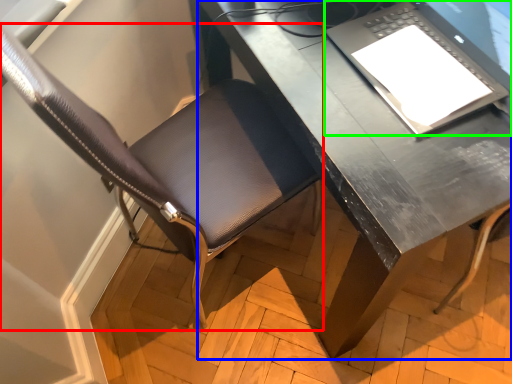
Question: Considering the real-world distances, which object is farthest from chair (highlighted by a red box)? desk (highlighted by a blue box) or laptop (highlighted by a green box)?

Choices:
 (A) desk
 (B) laptop

Answer: (B)